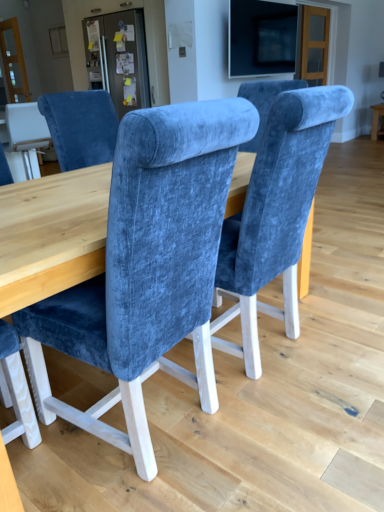
Find the location of a particular element. matte black screen at upper center is located at coordinates (261, 38).

From a real-world perspective, which is physically below, velvet blue chair at center or matte wood table at right?

matte wood table at right is physically lower.

Can you tell me how much velvet blue chair at center and matte wood table at right differ in facing direction?

The angle between the facing direction of velvet blue chair at center and the facing direction of matte wood table at right is 179 degrees.

Which object is closer to the camera taking this photo, velvet blue chair at center or matte wood table at right?

velvet blue chair at center.

From the image's perspective, would you say velvet blue chair at center is positioned over matte wood table at right?

No.

Is point (376, 109) less distant than point (289, 44)?

That is False.

From the image's perspective, which is above, matte wood table at right or matte black screen at upper center?

matte black screen at upper center, from the image's perspective.

Looking at this image, is matte wood table at right wider than matte black screen at upper center?

Indeed, matte wood table at right has a greater width compared to matte black screen at upper center.

Considering the sizes of objects velvet blue chair at center and matte black screen at upper center in the image provided, who is smaller, velvet blue chair at center or matte black screen at upper center?

With smaller size is matte black screen at upper center.

From the image's perspective, who appears lower, velvet blue chair at center or matte black screen at upper center?

velvet blue chair at center appears lower in the image.

Measure the distance between velvet blue chair at center and matte black screen at upper center.

They are 3.53 meters apart.

Is matte black screen at upper center located within velvet blue chair at center?

Actually, matte black screen at upper center is outside velvet blue chair at center.

Considering the sizes of objects matte black screen at upper center and matte wood table at right in the image provided, who is taller, matte black screen at upper center or matte wood table at right?

matte black screen at upper center is taller.

Considering the positions of objects matte black screen at upper center and matte wood table at right in the image provided, who is behind, matte black screen at upper center or matte wood table at right?

matte wood table at right is more distant.

Are matte black screen at upper center and matte wood table at right far apart?

matte black screen at upper center is positioned a significant distance from matte wood table at right.

Is matte black screen at upper center completely or partially outside of velvet blue chair at center?

Absolutely, matte black screen at upper center is external to velvet blue chair at center.

Can you confirm if matte black screen at upper center is bigger than velvet blue chair at center?

Incorrect, matte black screen at upper center is not larger than velvet blue chair at center.

Does matte black screen at upper center turn towards velvet blue chair at center?

No, matte black screen at upper center does not turn towards velvet blue chair at center.

Which object is further away from the camera, matte black screen at upper center or velvet blue chair at center?

Positioned behind is matte black screen at upper center.

Based on the photo, from the image's perspective, is matte wood table at right over velvet blue chair at center?

Yes, from the image's perspective, matte wood table at right is over velvet blue chair at center.

Identify the location of chair below the matte wood table at right (from the image's perspective). This screenshot has width=384, height=512. (147, 268).

Is matte wood table at right inside or outside of velvet blue chair at center?

matte wood table at right is not enclosed by velvet blue chair at center.

From a real-world perspective, does matte wood table at right sit lower than velvet blue chair at center?

Yes.

Find the location of a particular element. The width and height of the screenshot is (384, 512). chair below the matte wood table at right (from the image's perspective) is located at coordinates (147, 268).

Locate an element on the screen. table lying behind the matte black screen at upper center is located at coordinates (377, 121).

When comparing their distances from velvet blue chair at center, does matte black screen at upper center or matte wood table at right seem further?

matte wood table at right.

Estimate the real-world distances between objects in this image. Which object is further from matte wood table at right, velvet blue chair at center or matte black screen at upper center?

velvet blue chair at center.

From the image, which object appears to be nearer to velvet blue chair at center, matte wood table at right or matte black screen at upper center?

Among the two, matte black screen at upper center is located nearer to velvet blue chair at center.

Consider the image. From the image, which object appears to be nearer to matte wood table at right, matte black screen at upper center or velvet blue chair at center?

matte black screen at upper center.

Which object lies further to the anchor point matte black screen at upper center, matte wood table at right or velvet blue chair at center?

Among the two, velvet blue chair at center is located further to matte black screen at upper center.

Looking at the image, which one is located closer to matte black screen at upper center, velvet blue chair at center or matte wood table at right?

matte wood table at right.

The height and width of the screenshot is (512, 384). Identify the location of television between velvet blue chair at center and matte wood table at right along the z-axis. (261, 38).